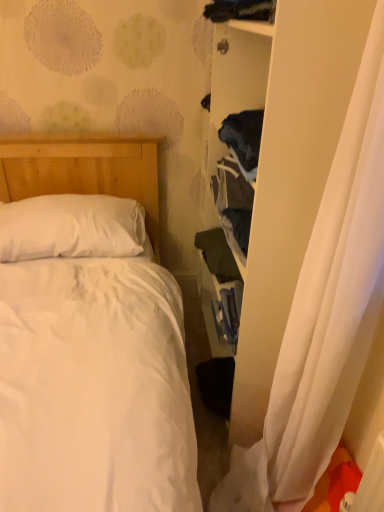
Question: Is dark green fabric at center-right, acting as the first clothing starting from the back, taller than white sheer curtain at right?

Choices:
 (A) yes
 (B) no

Answer: (B)

Question: Considering the relative positions of dark green fabric at center-right, placed as the 1th clothing when sorted from bottom to top, and white sheer curtain at right in the image provided, is dark green fabric at center-right, placed as the 1th clothing when sorted from bottom to top, to the right of white sheer curtain at right from the viewer's perspective?

Choices:
 (A) no
 (B) yes

Answer: (A)

Question: Is dark green fabric at center-right, placed as the 1th clothing when sorted from bottom to top, facing towards white sheer curtain at right?

Choices:
 (A) no
 (B) yes

Answer: (A)

Question: Is the surface of dark green fabric at center-right, positioned as the 2th clothing in front-to-back order, in direct contact with white sheer curtain at right?

Choices:
 (A) yes
 (B) no

Answer: (B)

Question: Is white sheer curtain at right at the back of dark green fabric at center-right, acting as the first clothing starting from the back?

Choices:
 (A) no
 (B) yes

Answer: (A)

Question: Looking at their shapes, would you say white soft pillow at upper left is wider or thinner than dark blue fabric at upper center, acting as the second clothing starting from the back?

Choices:
 (A) thin
 (B) wide

Answer: (B)

Question: Considering the positions of white soft pillow at upper left and dark blue fabric at upper center, acting as the second clothing starting from the back, in the image, is white soft pillow at upper left bigger or smaller than dark blue fabric at upper center, acting as the second clothing starting from the back,?

Choices:
 (A) small
 (B) big

Answer: (B)

Question: Is white soft pillow at upper left situated inside dark blue fabric at upper center, the second clothing in the bottom-to-top sequence, or outside?

Choices:
 (A) outside
 (B) inside

Answer: (A)

Question: From a real-world perspective, is white soft pillow at upper left physically located above or below dark blue fabric at upper center, acting as the second clothing starting from the back?

Choices:
 (A) below
 (B) above

Answer: (A)

Question: Does point (203, 247) appear closer or farther from the camera than point (52, 214)?

Choices:
 (A) closer
 (B) farther

Answer: (B)

Question: Considering their positions, is dark green fabric at center-right, placed as the 1th clothing when sorted from bottom to top, located in front of or behind white soft pillow at upper left?

Choices:
 (A) behind
 (B) front

Answer: (B)

Question: From a real-world perspective, is dark green fabric at center-right, placed as the 1th clothing when sorted from bottom to top, positioned above or below white soft pillow at upper left?

Choices:
 (A) above
 (B) below

Answer: (B)

Question: Would you say dark green fabric at center-right, positioned as the 2th clothing in front-to-back order, is to the left or to the right of white soft pillow at upper left in the picture?

Choices:
 (A) left
 (B) right

Answer: (B)

Question: Considering the positions of dark blue fabric at upper center, acting as the second clothing starting from the back, and white sheer curtain at right in the image, is dark blue fabric at upper center, acting as the second clothing starting from the back, wider or thinner than white sheer curtain at right?

Choices:
 (A) thin
 (B) wide

Answer: (A)

Question: Considering the positions of dark blue fabric at upper center, acting as the second clothing starting from the back, and white sheer curtain at right in the image, is dark blue fabric at upper center, acting as the second clothing starting from the back, taller or shorter than white sheer curtain at right?

Choices:
 (A) tall
 (B) short

Answer: (B)